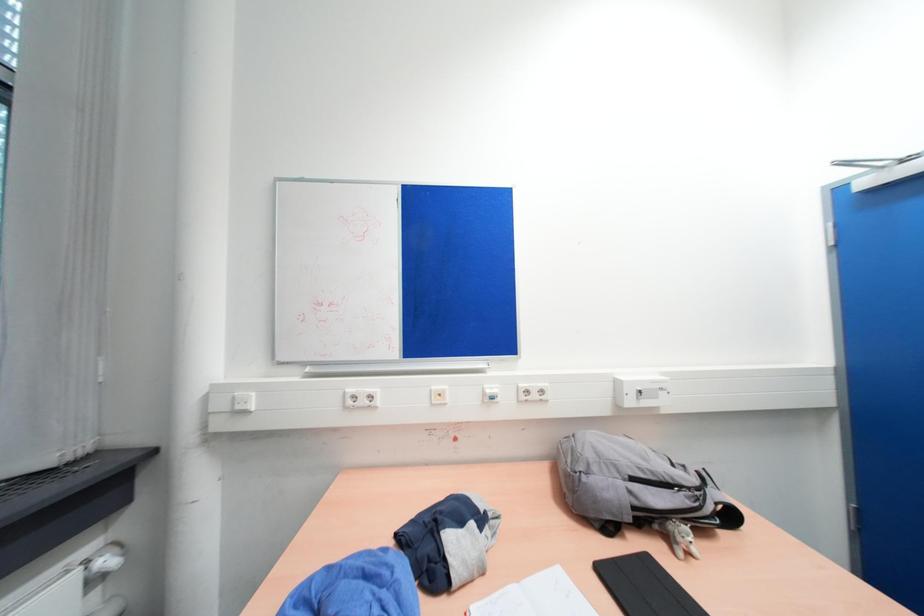
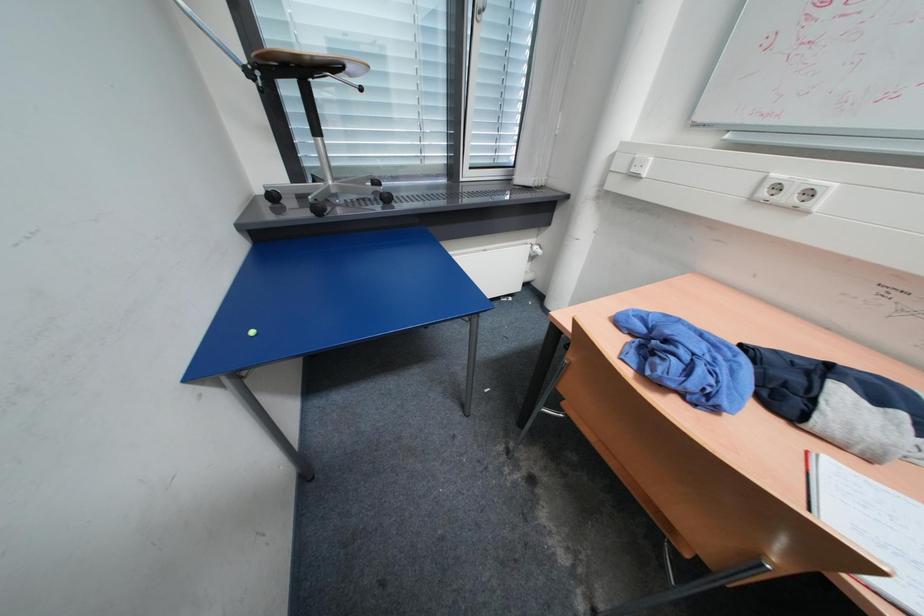
Based on the continuous images, in which direction is the camera rotating?

The camera rotated toward left-down.